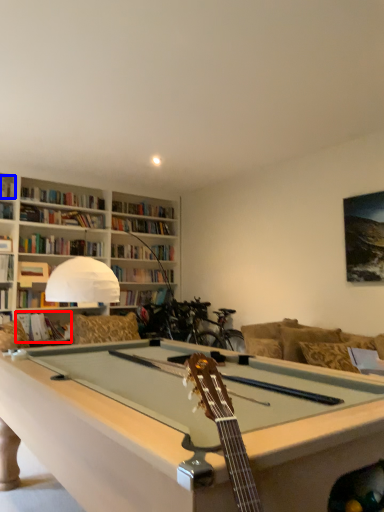
Question: Which point is further to the camera, book (highlighted by a red box) or book (highlighted by a blue box)?

Choices:
 (A) book
 (B) book

Answer: (B)